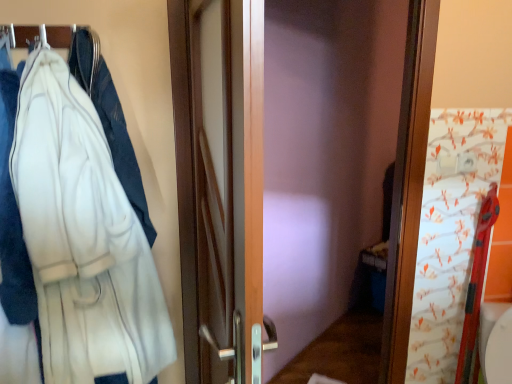
What do you see at coordinates (20, 35) in the screenshot? I see `metallic silver hanger at upper left` at bounding box center [20, 35].

This screenshot has width=512, height=384. Identify the location of white fleece jacket at left. (12, 216).

From the image's perspective, is white fleece jacket at left located above or below metallic silver hanger at upper left?

white fleece jacket at left is situated lower than metallic silver hanger at upper left in the image.

Looking at the image, does white fleece jacket at left seem bigger or smaller compared to metallic silver hanger at upper left?

white fleece jacket at left is bigger than metallic silver hanger at upper left.

Is white fleece jacket at left taller or shorter than metallic silver hanger at upper left?

white fleece jacket at left is taller than metallic silver hanger at upper left.

Does white fleece jacket at left appear on the right side of white fleece bathrobe at left?

In fact, white fleece jacket at left is to the left of white fleece bathrobe at left.

Is the position of white fleece jacket at left less distant than that of white fleece bathrobe at left?

That is False.

At what (x,y) coordinates should I click in order to perform the action: click on garment located above the white fleece bathrobe at left (from the image's perspective). Please return your answer as a coordinate pair (x, y). This screenshot has height=384, width=512. Looking at the image, I should click on (12, 216).

From the image's perspective, does white fleece jacket at left appear higher than white fleece bathrobe at left?

Indeed, from the image's perspective, white fleece jacket at left is shown above white fleece bathrobe at left.

From a real-world perspective, is metallic silver hanger at upper left on top of white fleece jacket at left?

Yes, from a real-world perspective, metallic silver hanger at upper left is over white fleece jacket at left

Between metallic silver hanger at upper left and white fleece jacket at left, which one appears on the left side from the viewer's perspective?

white fleece jacket at left is more to the left.

How many degrees apart are the facing directions of metallic silver hanger at upper left and white fleece jacket at left?

The angular difference between metallic silver hanger at upper left and white fleece jacket at left is 0.000589 degrees.

Looking at this image, from the image's perspective, is metallic silver hanger at upper left beneath white fleece jacket at left?

No, from the image's perspective, metallic silver hanger at upper left is not below white fleece jacket at left.

Is point (50, 210) behind point (71, 30)?

No, (50, 210) is closer to viewer.

Locate an element on the screen. Image resolution: width=512 pixels, height=384 pixels. hanger that appears on the left of white fleece bathrobe at left is located at coordinates (20, 35).

Does white fleece bathrobe at left appear on the left side of metallic silver hanger at upper left?

Incorrect, white fleece bathrobe at left is not on the left side of metallic silver hanger at upper left.

Is metallic silver hanger at upper left inside white fleece bathrobe at left?

That's incorrect, metallic silver hanger at upper left is not inside white fleece bathrobe at left.

From a real-world perspective, which object rests below the other?

white fleece bathrobe at left.

Is metallic silver hanger at upper left wider than white fleece bathrobe at left?

Incorrect, the width of metallic silver hanger at upper left does not surpass that of white fleece bathrobe at left.

Is metallic silver hanger at upper left positioned beyond the bounds of white fleece bathrobe at left?

That's correct, metallic silver hanger at upper left is outside of white fleece bathrobe at left.

What's the angular difference between metallic silver hanger at upper left and white fleece bathrobe at left's facing directions?

There is a 0.000697-degree angle between the facing directions of metallic silver hanger at upper left and white fleece bathrobe at left.

Is white fleece bathrobe at left touching white fleece jacket at left?

No, white fleece bathrobe at left is not next to white fleece jacket at left.

Can you confirm if white fleece bathrobe at left is wider than white fleece jacket at left?

Yes.

Considering the relative sizes of white fleece bathrobe at left and white fleece jacket at left in the image provided, is white fleece bathrobe at left shorter than white fleece jacket at left?

In fact, white fleece bathrobe at left may be taller than white fleece jacket at left.

Is white fleece bathrobe at left aimed at white fleece jacket at left?

No, white fleece bathrobe at left is not facing towards white fleece jacket at left.

Where is `hanger above the white fleece jacket at left (from the image's perspective)`? The height and width of the screenshot is (384, 512). hanger above the white fleece jacket at left (from the image's perspective) is located at coordinates (20, 35).

Find the location of a particular element. This screenshot has width=512, height=384. garment positioned vertically above the white fleece bathrobe at left (from a real-world perspective) is located at coordinates (12, 216).

Which object lies further to the anchor point white fleece jacket at left, metallic silver hanger at upper left or white fleece bathrobe at left?

Based on the image, metallic silver hanger at upper left appears to be further to white fleece jacket at left.

Based on their spatial positions, is metallic silver hanger at upper left or white fleece jacket at left further from white fleece bathrobe at left?

metallic silver hanger at upper left lies further to white fleece bathrobe at left than the other object.

From the image, which object appears to be nearer to white fleece bathrobe at left, white fleece jacket at left or metallic silver hanger at upper left?

white fleece jacket at left is closer to white fleece bathrobe at left.

Which object lies further to the anchor point white fleece jacket at left, white fleece bathrobe at left or metallic silver hanger at upper left?

Among the two, metallic silver hanger at upper left is located further to white fleece jacket at left.

Looking at the image, which one is located further to metallic silver hanger at upper left, white fleece bathrobe at left or white fleece jacket at left?

white fleece bathrobe at left is further to metallic silver hanger at upper left.

Based on their spatial positions, is white fleece jacket at left or white fleece bathrobe at left further from metallic silver hanger at upper left?

white fleece bathrobe at left is further to metallic silver hanger at upper left.

At what (x,y) coordinates should I click in order to perform the action: click on garment between metallic silver hanger at upper left and white fleece bathrobe at left from top to bottom. Please return your answer as a coordinate pair (x, y). The image size is (512, 384). Looking at the image, I should click on (12, 216).